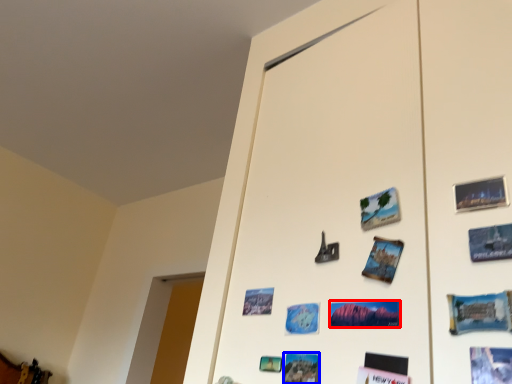
Question: Which of the following is the farthest to the observer, postcard (highlighted by a red box) or postcard (highlighted by a blue box)?

Choices:
 (A) postcard
 (B) postcard

Answer: (B)